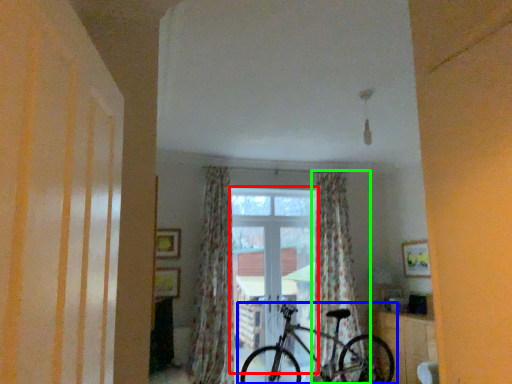
Question: Based on their relative distances, which object is farther from window (highlighted by a red box)? Choose from bicycle (highlighted by a blue box) and curtain (highlighted by a green box).

Choices:
 (A) bicycle
 (B) curtain

Answer: (A)